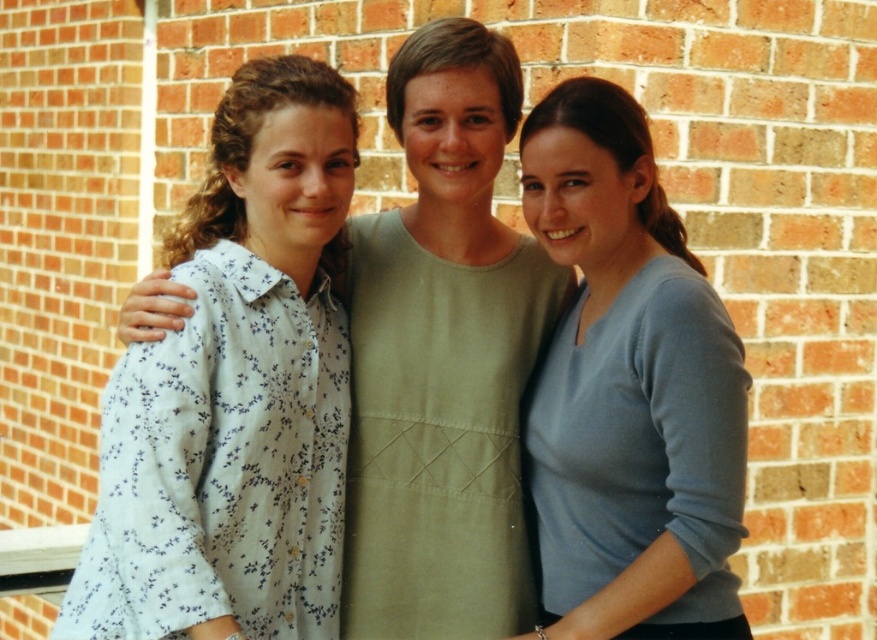
You are a photographer setting up a shot of the three people against the brick wall. You want to ensure the light green fabric dress at center and the light blue sweater at center are positioned correctly. According to the scene description, which of these two items is located to the left of the other?

The light green fabric dress at center is to the left of the light blue sweater at center.

You are trying to decide which clothing item to purchase between the white floral shirt at left and the light blue sweater at center. Based on their sizes in the image, which one would you choose if you prefer a larger size?

The white floral shirt at left is bigger than the light blue sweater at center, so you should choose the white floral shirt at left if you prefer a larger size.

You are a photographer setting up a shot of the three people against the brick wall. You need to ensure that the white floral shirt at left and the light green fabric dress at center are both clearly visible in the frame. Given their sizes, which clothing item should you focus on to ensure both are in focus?

The white floral shirt at left is larger than the light green fabric dress at center. To ensure both are in focus, focus on the white floral shirt at left since larger objects generally require more depth of field to keep them sharp.